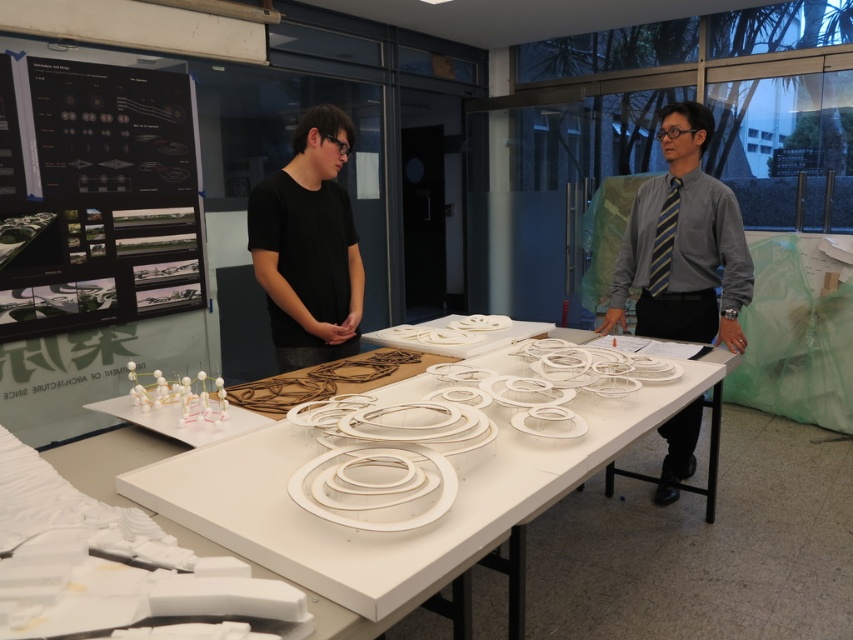
Can you confirm if gray shirt and tie at center is positioned above black matte shirt at center?

Yes.

Where is `gray shirt and tie at center`? Image resolution: width=853 pixels, height=640 pixels. gray shirt and tie at center is located at coordinates (683, 244).

You are a GUI agent. You are given a task and a screenshot of the screen. Output one action in this format:
    pyautogui.click(x=<x>, y=<y>)
    Task: Click on the gray shirt and tie at center
    
    Given the screenshot: What is the action you would take?
    pyautogui.click(x=683, y=244)

Does white matte sculpture at center appear on the left side of black matte shirt at center?

In fact, white matte sculpture at center is to the right of black matte shirt at center.

Is point (554, 480) farther from viewer compared to point (273, 324)?

No, (554, 480) is in front of (273, 324).

Does point (415, 557) come farther from viewer compared to point (334, 289)?

That is False.

This screenshot has height=640, width=853. I want to click on white matte sculpture at center, so click(405, 531).

Can you confirm if white matte sculpture at center is thinner than gray shirt and tie at center?

No.

Is white matte sculpture at center to the right of gray shirt and tie at center from the viewer's perspective?

In fact, white matte sculpture at center is to the left of gray shirt and tie at center.

I want to click on white matte sculpture at center, so click(x=405, y=531).

This screenshot has width=853, height=640. Find the location of `white matte sculpture at center`. white matte sculpture at center is located at coordinates click(x=405, y=531).